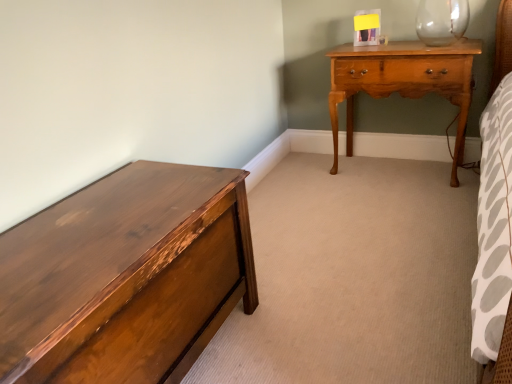
Identify the location of free space on the front side of light brown wood nightstand at upper right. The width and height of the screenshot is (512, 384). (403, 206).